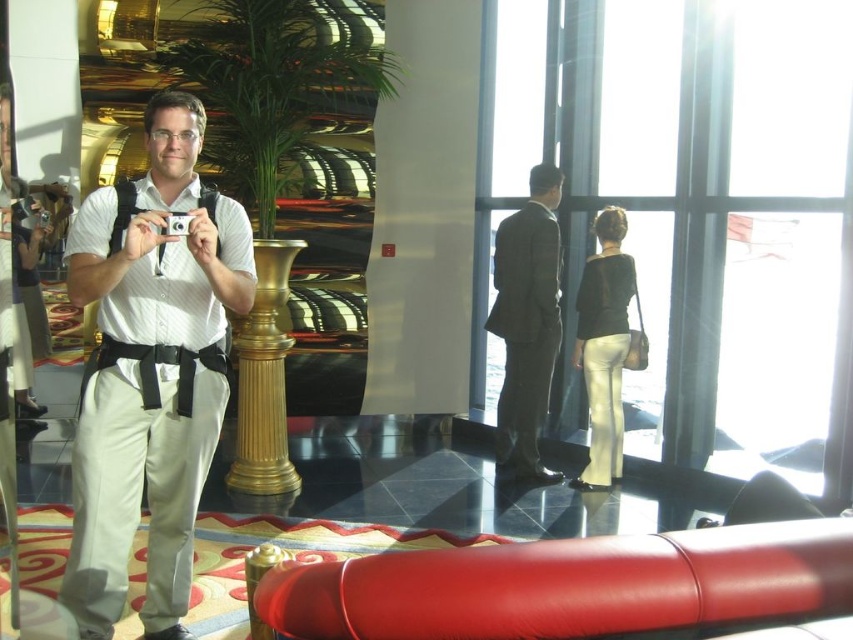
Question: Which point appears closest to the camera in this image?

Choices:
 (A) (554, 333)
 (B) (90, 257)

Answer: (B)

Question: Which of the following is the farthest from the observer?

Choices:
 (A) (498, 440)
 (B) (148, 321)

Answer: (A)

Question: Can you confirm if white cotton shirt at center is smaller than dark gray suit at center?

Choices:
 (A) yes
 (B) no

Answer: (B)

Question: Can you confirm if white cotton shirt at center is thinner than dark gray suit at center?

Choices:
 (A) no
 (B) yes

Answer: (A)

Question: Is white cotton shirt at center wider than dark gray suit at center?

Choices:
 (A) yes
 (B) no

Answer: (A)